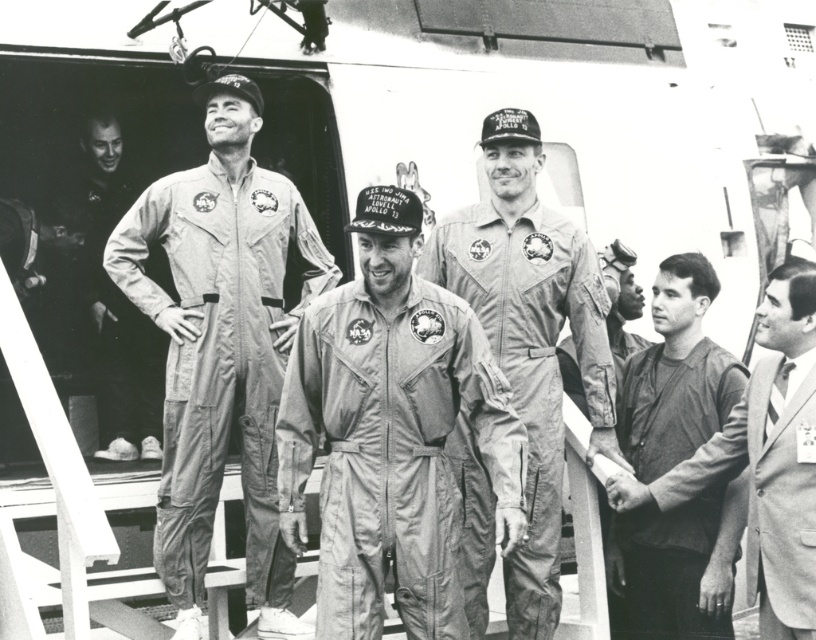
You are standing on the deck of the ship in the image. There is a point marked at coordinates point [765,458]. Which object is located at that point?

The dark gray suit at center is located at point [765,458].

You are an astronaut who just returned from a mission and is standing on the deck of a ship. You see the matte gray jumpsuit at center and the dark gray suit at center. Which one is physically nearer to you?

The matte gray jumpsuit at center is closer to the viewer than the dark gray suit at center, so the matte gray jumpsuit at center is physically nearer to you.